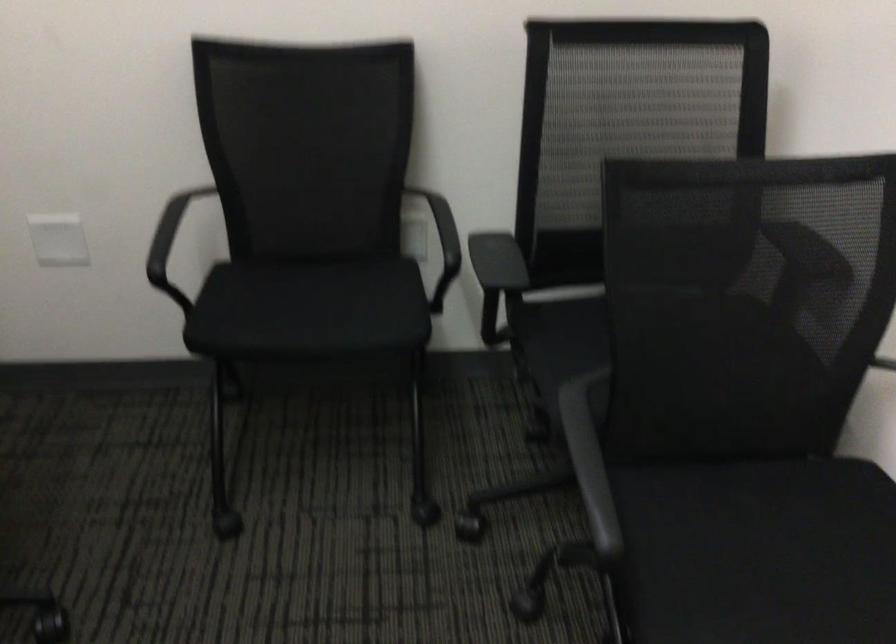
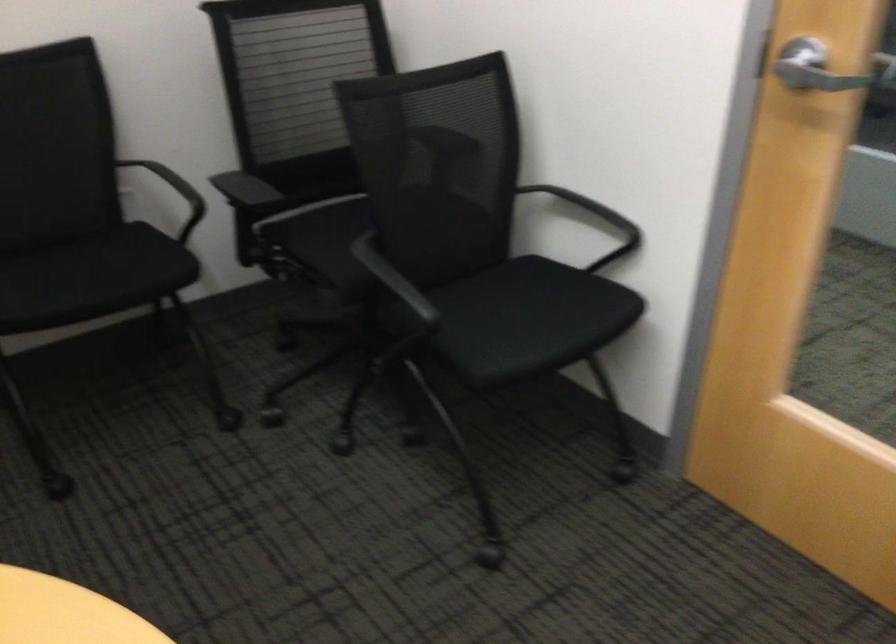
The point at (x=458, y=227) is marked in the first image. Where is the corresponding point in the second image?

(174, 192)